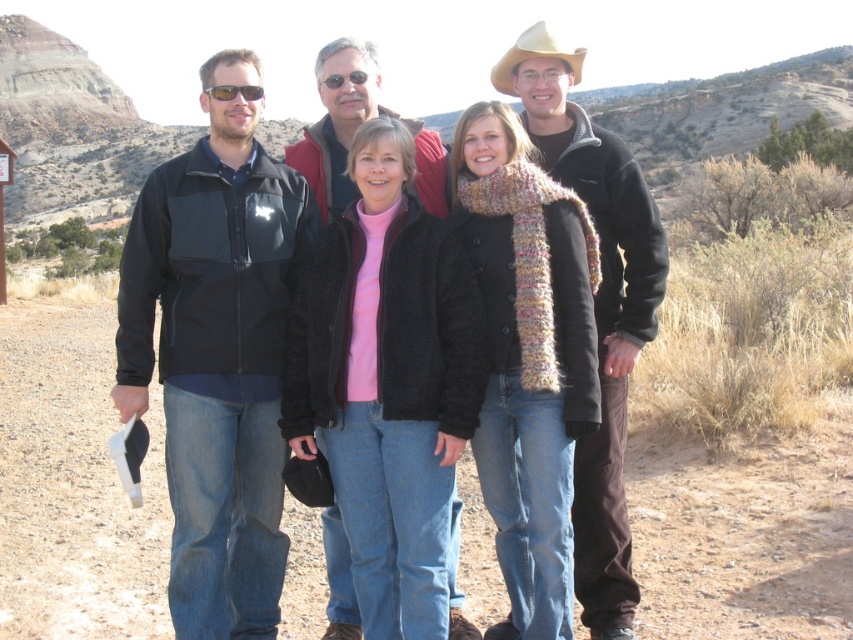
Question: Can you confirm if dirt track at center is positioned to the right of tan felt cowboy hat at upper center?

Choices:
 (A) no
 (B) yes

Answer: (A)

Question: Which object is the farthest from the matte black jacket at center?

Choices:
 (A) silver reflective sunglasses at upper left
 (B) tan felt cowboy hat at upper center
 (C) knitted wool scarf at center

Answer: (B)

Question: Does dirt track at center have a greater width compared to matte black jacket at left?

Choices:
 (A) yes
 (B) no

Answer: (A)

Question: Which point is farther to the camera?

Choices:
 (A) knitted wool scarf at center
 (B) silver reflective sunglasses at upper left
 (C) matte black jacket at left

Answer: (B)

Question: Does matte black jacket at center have a lesser width compared to silver reflective sunglasses at upper left?

Choices:
 (A) no
 (B) yes

Answer: (A)

Question: Which of the following is the farthest from the observer?

Choices:
 (A) (216, 99)
 (B) (91, 513)
 (C) (631, 166)

Answer: (B)